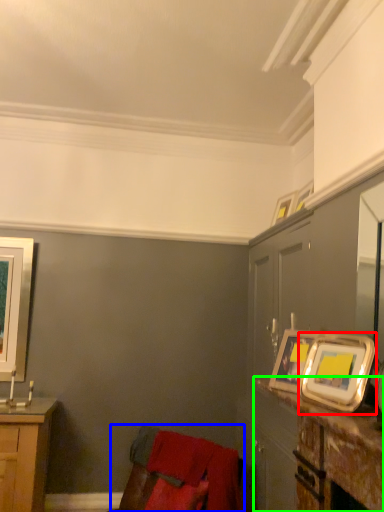
Question: Which object is positioned closest to picture frame (highlighted by a red box)? Select from swivel chair (highlighted by a blue box) and table (highlighted by a green box).

Choices:
 (A) swivel chair
 (B) table

Answer: (B)